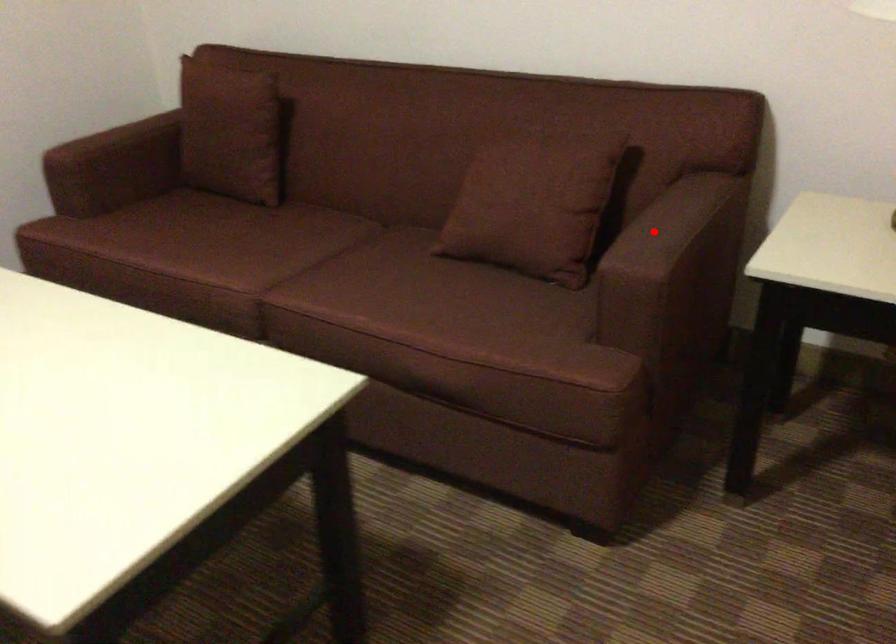
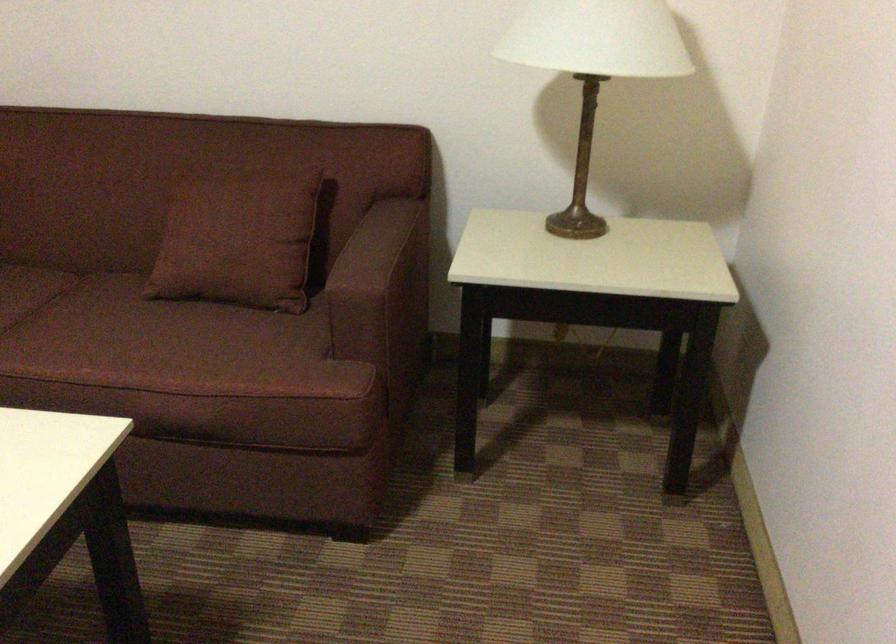
Find the pixel in the second image that matches the highlighted location in the first image.

(367, 254)